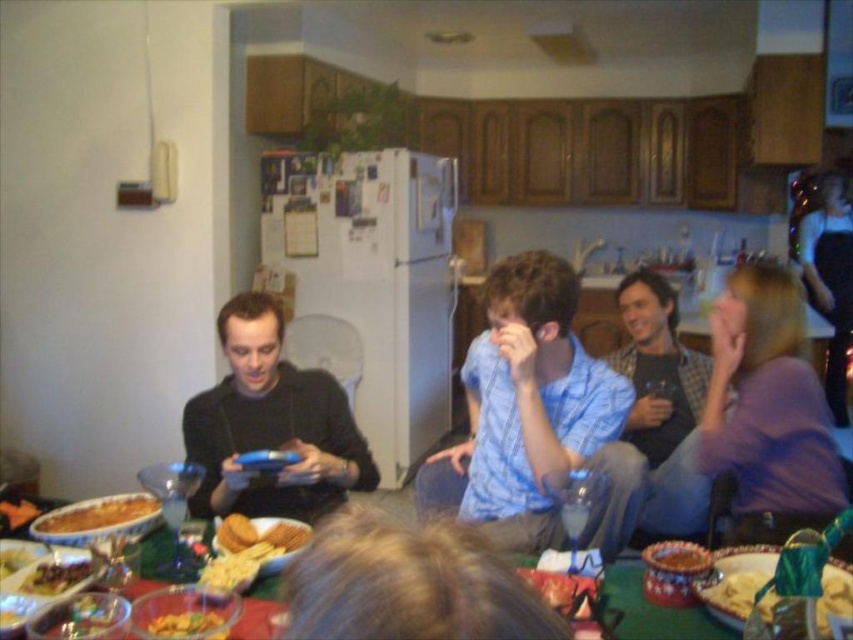
Question: Does green felt table at lower center come in front of yellow crumbly snack at lower left?

Choices:
 (A) no
 (B) yes

Answer: (B)

Question: Is golden crispy chips at center to the left of golden crispy chips at lower center from the viewer's perspective?

Choices:
 (A) yes
 (B) no

Answer: (A)

Question: Which object is the closest to the golden crispy chips at lower center?

Choices:
 (A) yellow crumbly snack at lower left
 (B) green felt table at lower center
 (C) shiny chocolate cake at lower left
 (D) shiny plastic baguette at lower right

Answer: (D)

Question: Which object is positioned closest to the light blue shirt at center?

Choices:
 (A) yellow crumbly snack at center
 (B) golden crispy chips at lower center

Answer: (B)

Question: Considering the real-world distances, which object is farthest from the golden crispy chips at lower center?

Choices:
 (A) golden crispy chips at center
 (B) green felt table at lower center
 (C) light blue shirt at center
 (D) black matte shirt at center

Answer: (D)

Question: Does green felt table at lower center appear under golden crispy chips at lower center?

Choices:
 (A) yes
 (B) no

Answer: (A)